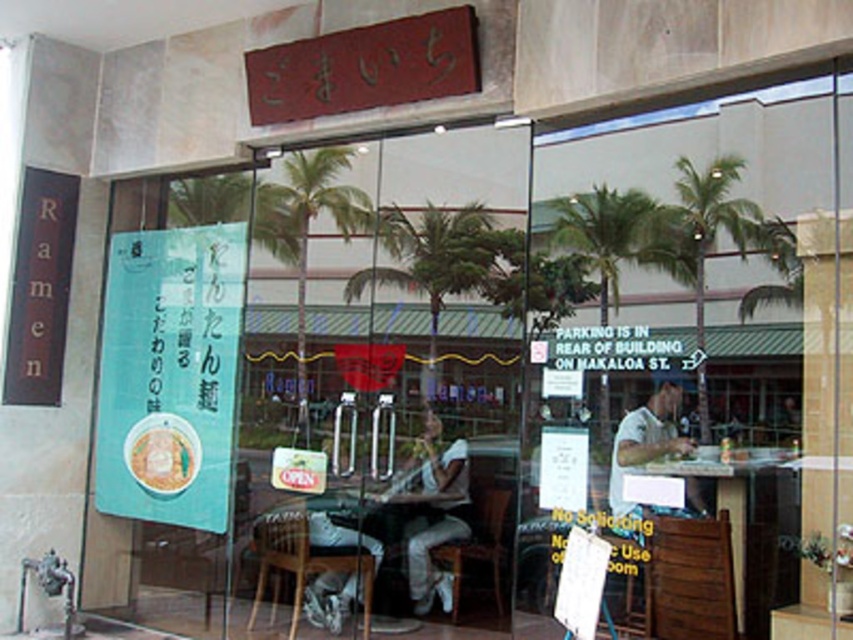
Can you confirm if wooden table at center is thinner than rattan chair at lower center?

Yes, wooden table at center is thinner than rattan chair at lower center.

Which is behind, point (759, 522) or point (364, 621)?

Positioned behind is point (364, 621).

Who is more distant from viewer, (656, 467) or (306, 552)?

Positioned behind is point (306, 552).

The width and height of the screenshot is (853, 640). Find the location of `wooden table at center`. wooden table at center is located at coordinates (743, 525).

Does rattan chair at lower center appear on the right side of green leafy palm tree at center?

No, rattan chair at lower center is not to the right of green leafy palm tree at center.

Which is more to the right, rattan chair at lower center or green leafy palm tree at center?

From the viewer's perspective, green leafy palm tree at center appears more on the right side.

Between point (308, 572) and point (616, 237), which one is positioned behind?

The point (308, 572) is more distant.

Where is `rattan chair at lower center`? rattan chair at lower center is located at coordinates (314, 561).

Does point (16, 308) lie behind point (607, 224)?

Yes, point (16, 308) is farther from viewer.

Which of these two, black wood sign at left or green leafy palm tree at center, stands taller?

With more height is black wood sign at left.

In order to click on black wood sign at left in this screenshot , I will do `click(39, 289)`.